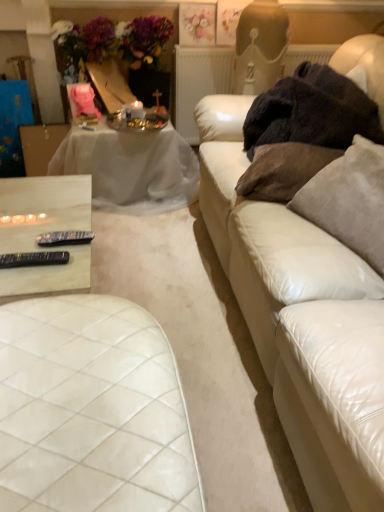
Question: Does pastel floral print at upper center appear on the right side of white quilted leather ottoman at lower left?

Choices:
 (A) no
 (B) yes

Answer: (B)

Question: Considering the relative sizes of pastel floral print at upper center and white quilted leather ottoman at lower left in the image provided, is pastel floral print at upper center shorter than white quilted leather ottoman at lower left?

Choices:
 (A) no
 (B) yes

Answer: (B)

Question: Is the depth of pastel floral print at upper center greater than that of white quilted leather ottoman at lower left?

Choices:
 (A) yes
 (B) no

Answer: (A)

Question: From the image's perspective, is pastel floral print at upper center above white quilted leather ottoman at lower left?

Choices:
 (A) no
 (B) yes

Answer: (B)

Question: Does pastel floral print at upper center turn towards white quilted leather ottoman at lower left?

Choices:
 (A) yes
 (B) no

Answer: (A)

Question: In the image, is white sheer cloth at upper left, marked as the 2th table in a front-to-back arrangement, positioned in front of or behind black plastic remote control at lower left, arranged as the 2th tableware when viewed from the top?

Choices:
 (A) front
 (B) behind

Answer: (B)

Question: From a real-world perspective, is white sheer cloth at upper left, the second table in the bottom-to-top sequence, above or below black plastic remote control at lower left, the first tableware positioned from the front?

Choices:
 (A) below
 (B) above

Answer: (A)

Question: Would you say white sheer cloth at upper left, which is the first table in top-to-bottom order, is inside or outside black plastic remote control at lower left, the 1th tableware when ordered from bottom to top?

Choices:
 (A) inside
 (B) outside

Answer: (B)

Question: From the image's perspective, is white sheer cloth at upper left, the second table in the bottom-to-top sequence, above or below black plastic remote control at lower left, the 1th tableware when ordered from bottom to top?

Choices:
 (A) below
 (B) above

Answer: (B)

Question: Based on their sizes in the image, would you say suede-like beige pillow at right, which is counted as the second pillow, starting from the left, is bigger or smaller than white quilted leather ottoman at lower left?

Choices:
 (A) small
 (B) big

Answer: (A)

Question: From their relative heights in the image, would you say suede-like beige pillow at right, which is counted as the second pillow, starting from the left, is taller or shorter than white quilted leather ottoman at lower left?

Choices:
 (A) tall
 (B) short

Answer: (B)

Question: Is suede-like beige pillow at right, which is the first pillow in right-to-left order, inside or outside of white quilted leather ottoman at lower left?

Choices:
 (A) outside
 (B) inside

Answer: (A)

Question: From the image's perspective, is suede-like beige pillow at right, which is counted as the second pillow, starting from the left, above or below white quilted leather ottoman at lower left?

Choices:
 (A) above
 (B) below

Answer: (A)

Question: Visually, is white sheer cloth at upper left, marked as the 2th table in a front-to-back arrangement, positioned to the left or to the right of brown fabric pillow at right, which ranks as the first pillow in left-to-right order?

Choices:
 (A) left
 (B) right

Answer: (A)

Question: Is white sheer cloth at upper left, the second table in the bottom-to-top sequence, situated inside brown fabric pillow at right, which ranks as the second pillow in right-to-left order, or outside?

Choices:
 (A) outside
 (B) inside

Answer: (A)